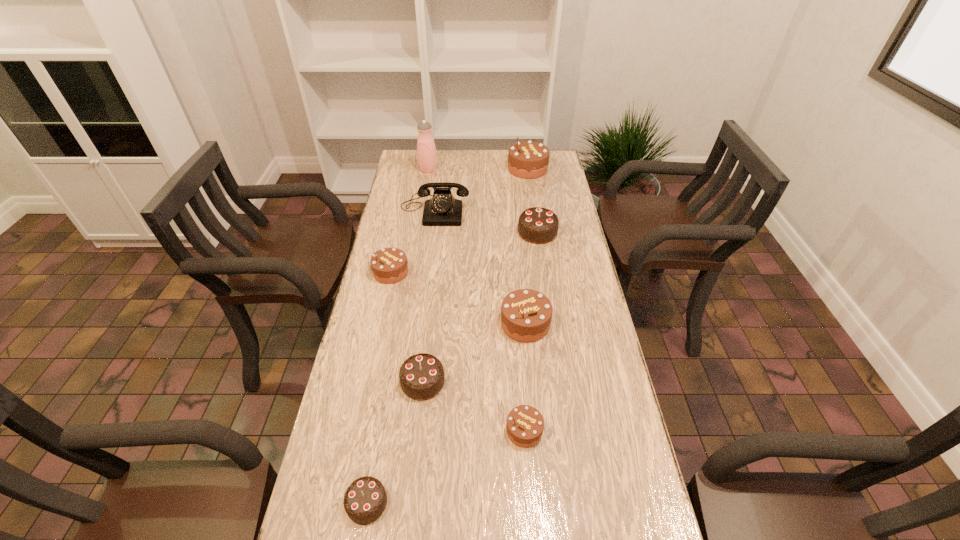
I want to click on the tallest object, so (426, 151).

This screenshot has width=960, height=540. What are the coordinates of `the farthest chocolate cake` in the screenshot? It's located at [x=527, y=159].

Where is `the biggest brown chocolate cake`? This screenshot has width=960, height=540. the biggest brown chocolate cake is located at coordinates (527, 159).

At what (x,y) coordinates should I click in order to perform the action: click on telephone. Please return your answer as a coordinate pair (x, y). Image resolution: width=960 pixels, height=540 pixels. Looking at the image, I should click on pos(442,209).

You are a GUI agent. You are given a task and a screenshot of the screen. Output one action in this format:
    pyautogui.click(x=<x>, y=<y>)
    Task: Click on the fourth farthest chocolate cake
    The height and width of the screenshot is (540, 960).
    Given the screenshot: What is the action you would take?
    pyautogui.click(x=526, y=314)

This screenshot has width=960, height=540. I want to click on the third smallest brown chocolate cake, so click(526, 314).

At what (x,y) coordinates should I click in order to perform the action: click on the farthest chocolate chocolate cake. Please return your answer as a coordinate pair (x, y). Looking at the image, I should click on (536, 225).

Identify the location of the biggest chocolate chocolate cake. Image resolution: width=960 pixels, height=540 pixels. 536,225.

Locate an element on the screen. The width and height of the screenshot is (960, 540). the fifth nearest chocolate cake is located at coordinates (389, 265).

Where is `the second smallest brown chocolate cake`? This screenshot has width=960, height=540. the second smallest brown chocolate cake is located at coordinates (389, 265).